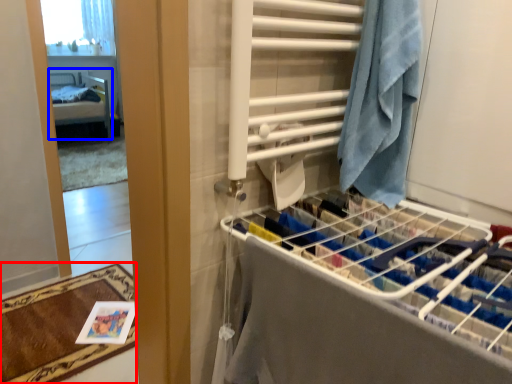
Question: Which point is closer to the camera, bath mat (highlighted by a red box) or furniture (highlighted by a blue box)?

Choices:
 (A) bath mat
 (B) furniture

Answer: (A)